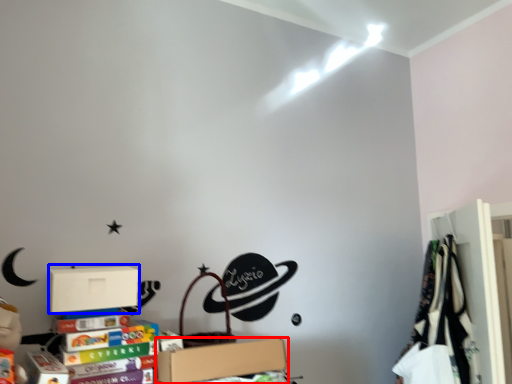
Question: Among these objects, which one is nearest to the camera, box (highlighted by a red box) or cardboard box (highlighted by a blue box)?

Choices:
 (A) box
 (B) cardboard box

Answer: (A)